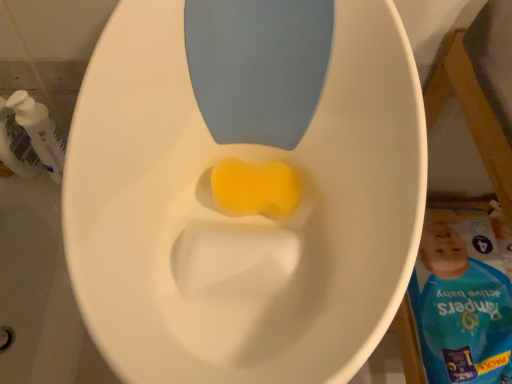
This screenshot has height=384, width=512. What do you see at coordinates (255, 188) in the screenshot?
I see `yellow sponge at center` at bounding box center [255, 188].

You are a GUI agent. You are given a task and a screenshot of the screen. Output one action in this format:
    pyautogui.click(x=<x>, y=<y>)
    Task: Click on the yellow sponge at center
    This screenshot has height=384, width=512.
    Given the screenshot: What is the action you would take?
    pyautogui.click(x=255, y=188)

Describe the element at coordinates (30, 137) in the screenshot. I see `white plastic pump bottle at left` at that location.

Identify the location of white plastic pump bottle at left. The height and width of the screenshot is (384, 512). (30, 137).

Locate an element on the screen. yellow sponge at center is located at coordinates (255, 188).

Which is more to the right, yellow sponge at center or white plastic pump bottle at left?

From the viewer's perspective, yellow sponge at center appears more on the right side.

Which is behind, yellow sponge at center or white plastic pump bottle at left?

white plastic pump bottle at left is further away from the camera.

Is point (279, 213) closer or farther from the camera than point (13, 129)?

Clearly, point (279, 213) is closer to the camera than point (13, 129).

From the image's perspective, which is above, yellow sponge at center or white plastic pump bottle at left?

white plastic pump bottle at left is shown above in the image.

From a real-world perspective, between yellow sponge at center and white plastic pump bottle at left, who is vertically higher?

In real-world perspective, yellow sponge at center is above.

Considering the sizes of objects yellow sponge at center and white plastic pump bottle at left in the image provided, who is thinner, yellow sponge at center or white plastic pump bottle at left?

Thinner between the two is white plastic pump bottle at left.

Considering the sizes of objects yellow sponge at center and white plastic pump bottle at left in the image provided, who is taller, yellow sponge at center or white plastic pump bottle at left?

Standing taller between the two is white plastic pump bottle at left.

Is yellow sponge at center bigger than white plastic pump bottle at left?

No, yellow sponge at center is not bigger than white plastic pump bottle at left.

Could white plastic pump bottle at left be considered to be inside yellow sponge at center?

No, white plastic pump bottle at left is not surrounded by yellow sponge at center.

Would you say yellow sponge at center is a long distance from white plastic pump bottle at left?

No, yellow sponge at center is not far away from white plastic pump bottle at left.

Is yellow sponge at center facing towards white plastic pump bottle at left?

No, yellow sponge at center is not facing towards white plastic pump bottle at left.

What's the angular difference between yellow sponge at center and white plastic pump bottle at left's facing directions?

They differ by 5.07 degrees in their facing directions.

The width and height of the screenshot is (512, 384). What are the coordinates of `food located on the right of white plastic pump bottle at left` in the screenshot? It's located at (255, 188).

Between white plastic pump bottle at left and yellow sponge at center, which one appears on the left side from the viewer's perspective?

From the viewer's perspective, white plastic pump bottle at left appears more on the left side.

Does white plastic pump bottle at left come behind yellow sponge at center?

Yes, it is behind yellow sponge at center.

Between point (59, 143) and point (224, 178), which one is positioned in front?

The point (224, 178) is closer.

From the image's perspective, which one is positioned lower, white plastic pump bottle at left or yellow sponge at center?

yellow sponge at center is shown below in the image.

From a real-world perspective, which is physically above, white plastic pump bottle at left or yellow sponge at center?

From a 3D spatial view, yellow sponge at center is above.

Considering the sizes of white plastic pump bottle at left and yellow sponge at center in the image, is white plastic pump bottle at left wider or thinner than yellow sponge at center?

white plastic pump bottle at left is thinner than yellow sponge at center.

Considering the sizes of white plastic pump bottle at left and yellow sponge at center in the image, is white plastic pump bottle at left taller or shorter than yellow sponge at center?

In the image, white plastic pump bottle at left appears to be taller than yellow sponge at center.

Considering the relative sizes of white plastic pump bottle at left and yellow sponge at center in the image provided, is white plastic pump bottle at left bigger than yellow sponge at center?

Indeed, white plastic pump bottle at left has a larger size compared to yellow sponge at center.

Do you think white plastic pump bottle at left is within yellow sponge at center, or outside of it?

white plastic pump bottle at left is not inside yellow sponge at center, it's outside.

Is white plastic pump bottle at left positioned far away from yellow sponge at center?

white plastic pump bottle at left is actually quite close to yellow sponge at center.

Is white plastic pump bottle at left turned away from yellow sponge at center?

No, white plastic pump bottle at left is not facing away from yellow sponge at center.

This screenshot has height=384, width=512. I want to click on food above the white plastic pump bottle at left (from a real-world perspective), so click(x=255, y=188).

This screenshot has height=384, width=512. I want to click on food above the white plastic pump bottle at left (from a real-world perspective), so click(255, 188).

At what (x,y) coordinates should I click in order to perform the action: click on cleaning product below the yellow sponge at center (from a real-world perspective). Please return your answer as a coordinate pair (x, y). This screenshot has width=512, height=384. Looking at the image, I should click on (30, 137).